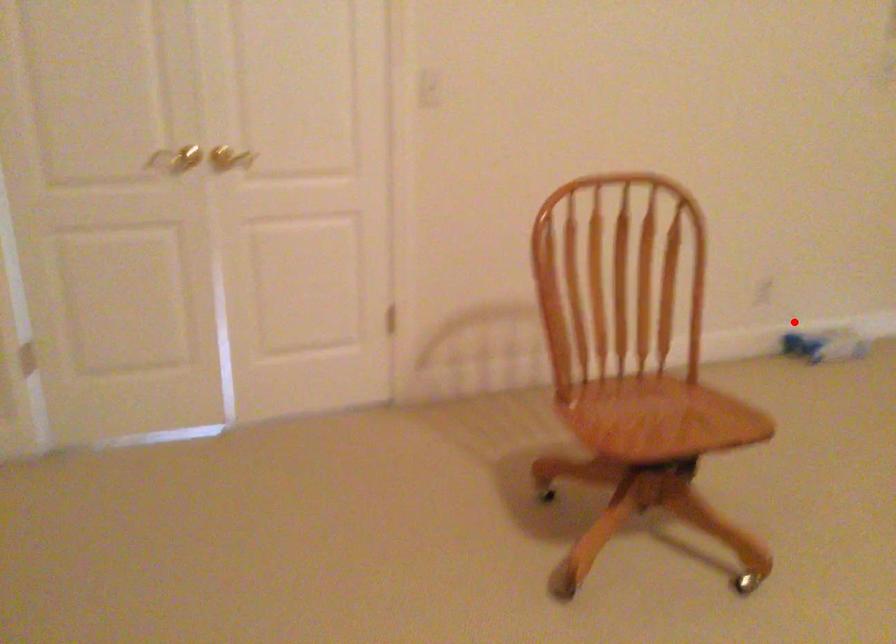
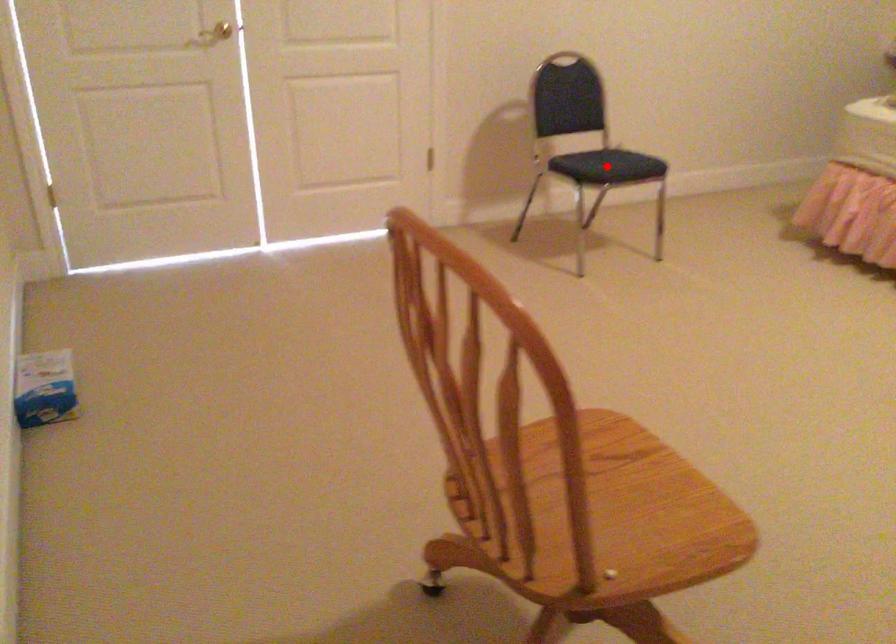
I am providing you with two images of the same scene from different viewpoints. A red point is marked on the first image and another point is marked on the second image. Does the point marked in image1 correspond to the same location as the one in image2?

No